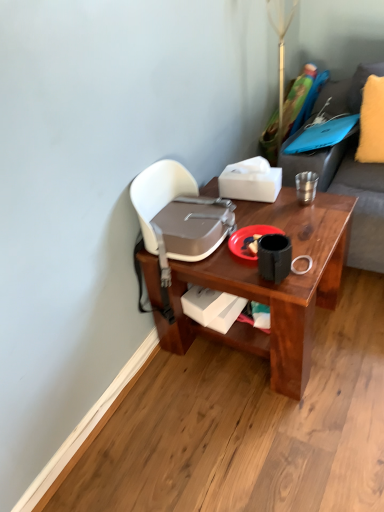
This screenshot has width=384, height=512. Find the location of `free space to the right of red matte plate at center`. free space to the right of red matte plate at center is located at coordinates (308, 232).